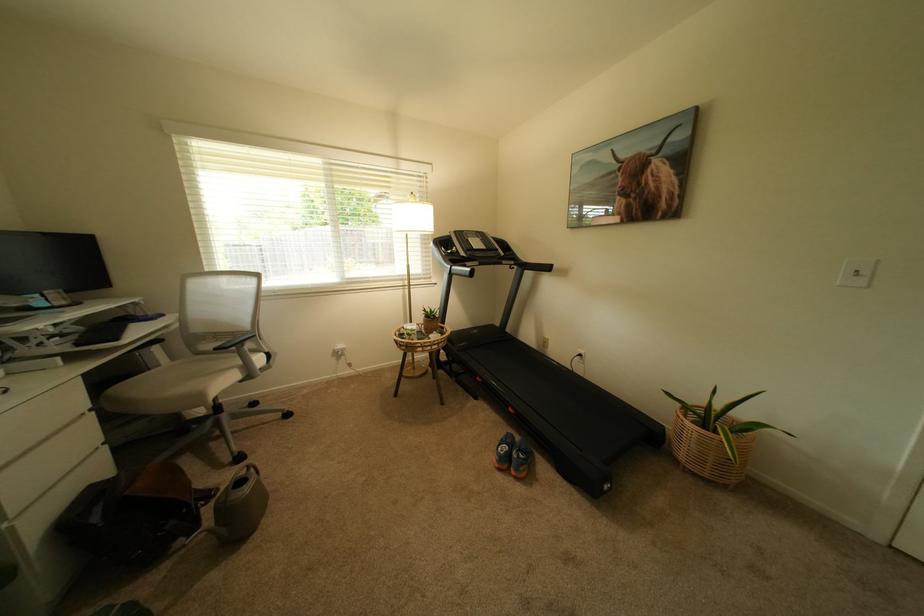
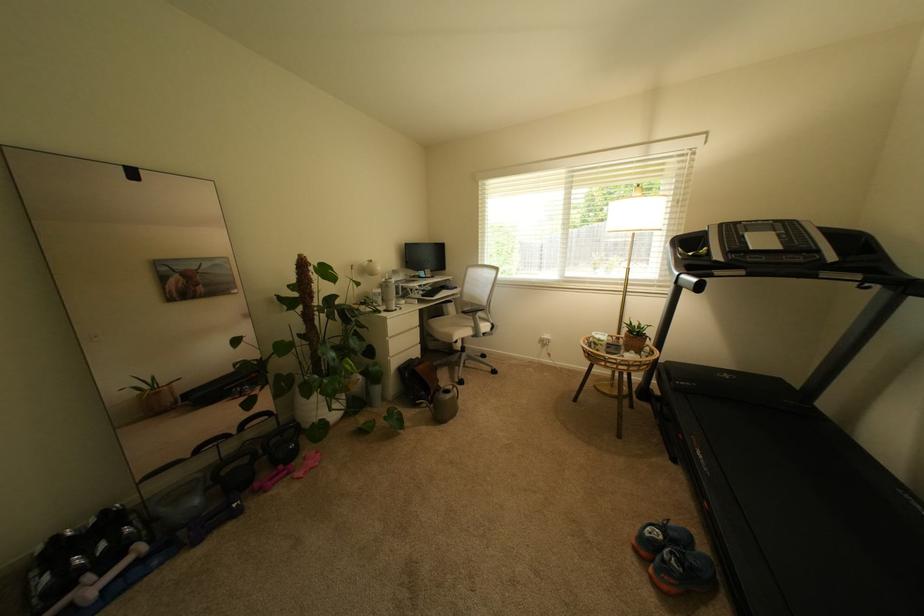
Find the pixel in the second image that matches [460,273] in the first image.

(688, 283)